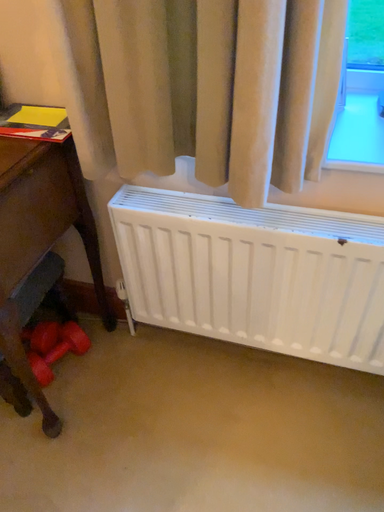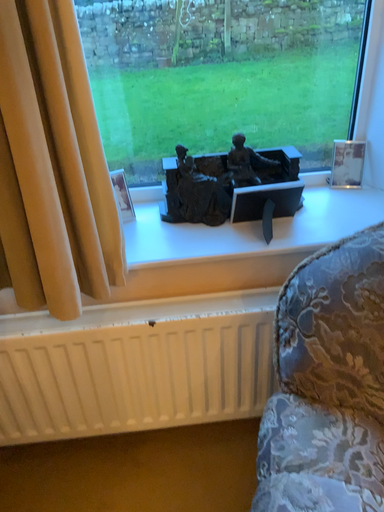
Question: How did the camera likely rotate when shooting the video?

Choices:
 (A) rotated upward
 (B) rotated downward

Answer: (A)